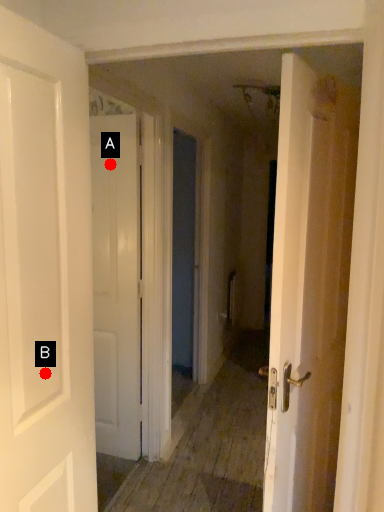
Question: Two points are circled on the image, labeled by A and B beside each circle. Which of the following is the closest to the observer?

Choices:
 (A) A is closer
 (B) B is closer

Answer: (B)